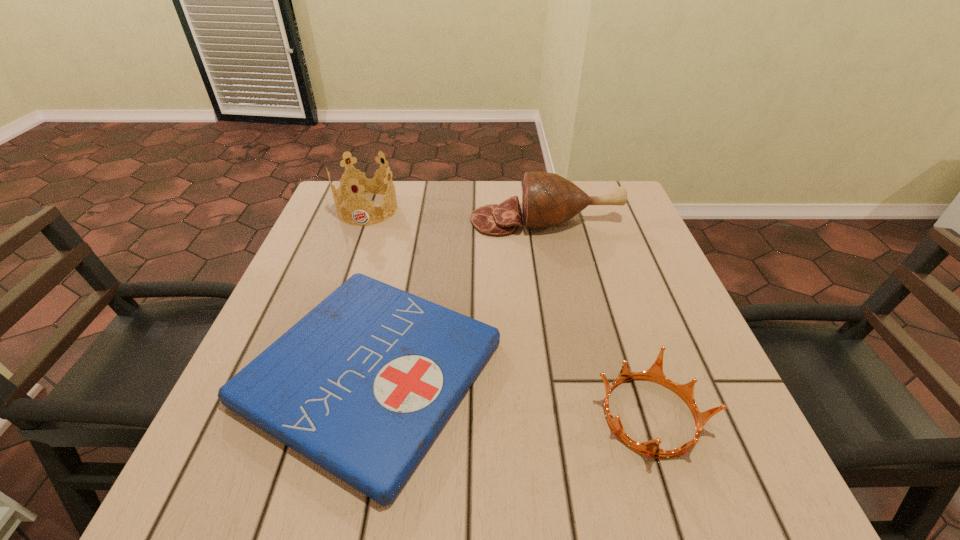
In order to click on vacant area in the image that satisfies the following two spatial constraints: 1. at the sliced end of the ham; 2. on the right side of the nearer crown in this screenshot , I will do `click(585, 416)`.

I want to click on vacant area that satisfies the following two spatial constraints: 1. at the sliced end of the second shortest object; 2. on the right side of the ham, so click(x=585, y=416).

Identify the location of blank area in the image that satisfies the following two spatial constraints: 1. at the sliced end of the ham; 2. on the back side of the shorter crown. Image resolution: width=960 pixels, height=540 pixels. (585, 416).

At what (x,y) coordinates should I click in order to perform the action: click on blank area in the image that satisfies the following two spatial constraints: 1. at the sliced end of the ham; 2. on the front side of the shortest object. Please return your answer as a coordinate pair (x, y). This screenshot has height=540, width=960. Looking at the image, I should click on (576, 373).

Locate an element on the screen. vacant space that satisfies the following two spatial constraints: 1. at the sliced end of the second shortest object; 2. on the right side of the ham is located at coordinates (585, 416).